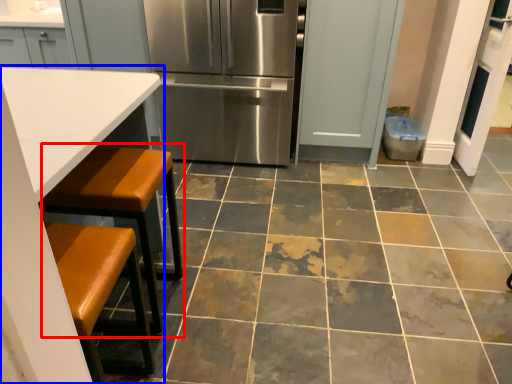
Question: Which object appears closest to the camera in this image, step stool (highlighted by a red box) or table (highlighted by a blue box)?

Choices:
 (A) step stool
 (B) table

Answer: (B)